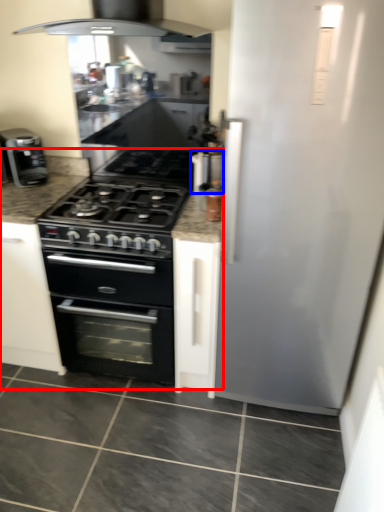
Question: Which object is further to the camera taking this photo, counter (highlighted by a red box) or appliance (highlighted by a blue box)?

Choices:
 (A) counter
 (B) appliance

Answer: (B)